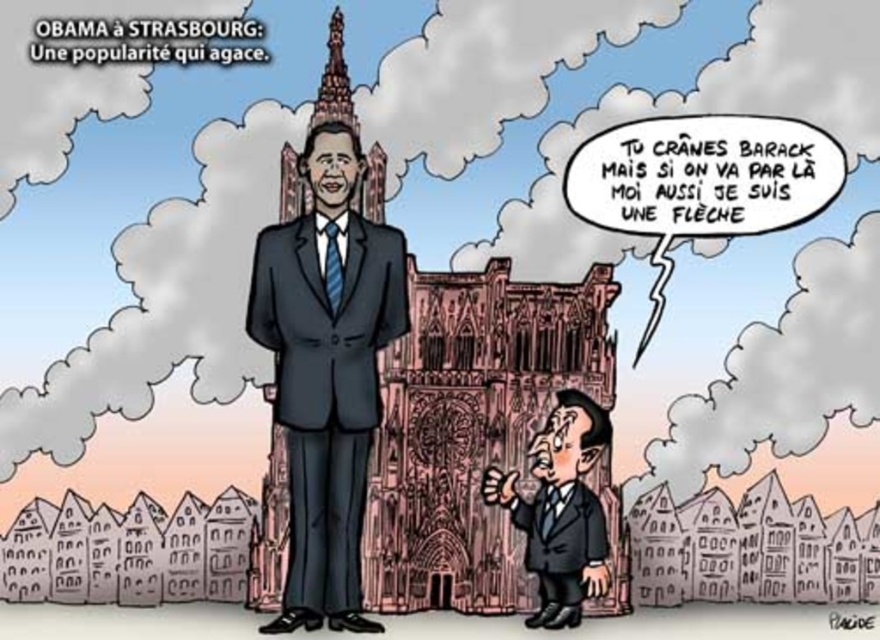
Question: Which of these objects is positioned farthest from the matte black suit at lower right?

Choices:
 (A) matte black suit at center
 (B) dark gray suit at lower right

Answer: (A)

Question: In this image, where is matte black suit at center located relative to matte black suit at lower right?

Choices:
 (A) above
 (B) below

Answer: (A)

Question: Does matte black suit at center have a lesser width compared to matte black suit at lower right?

Choices:
 (A) yes
 (B) no

Answer: (B)

Question: Which of the following is the closest to the observer?

Choices:
 (A) (554, 515)
 (B) (574, 541)
 (C) (310, 268)

Answer: (B)

Question: Which of the following is the closest to the observer?

Choices:
 (A) (500, 493)
 (B) (361, 368)
 (C) (534, 508)

Answer: (A)

Question: From the image, what is the correct spatial relationship of matte black suit at center in relation to dark gray suit at lower right?

Choices:
 (A) above
 (B) below

Answer: (A)